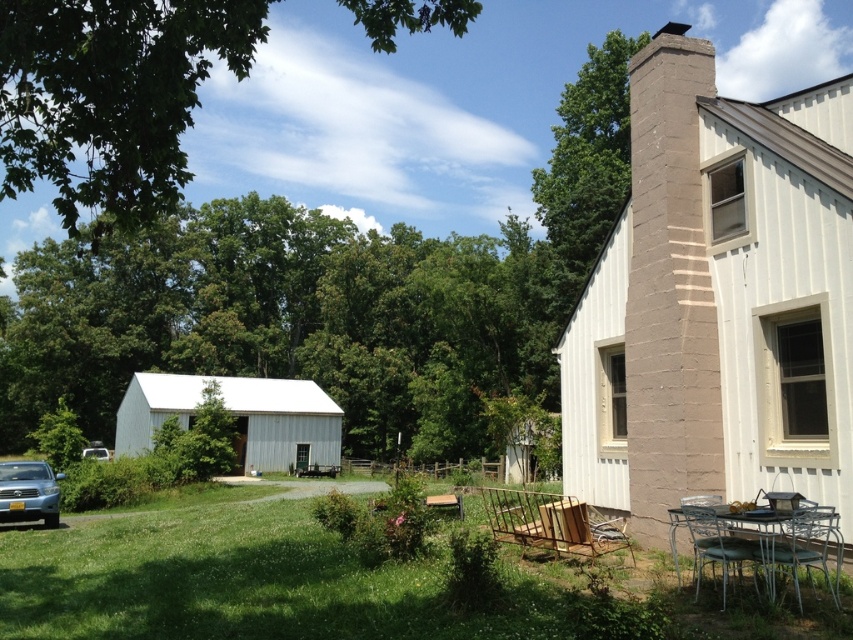
Who is taller, green leafy tree at upper left or metallic silver table at lower right?

With more height is green leafy tree at upper left.

Is green leafy tree at upper left closer to the viewer compared to metallic silver table at lower right?

Yes, it is.

Locate an element on the screen. green leafy tree at upper left is located at coordinates (111, 97).

Where is `green leafy tree at upper left`? The width and height of the screenshot is (853, 640). green leafy tree at upper left is located at coordinates (111, 97).

Which is above, wooden chair at lower center or white matte car at left?

wooden chair at lower center is higher up.

Does wooden chair at lower center have a larger size compared to white matte car at left?

No, wooden chair at lower center is not bigger than white matte car at left.

Which is in front, point (576, 513) or point (86, 449)?

Positioned in front is point (576, 513).

Locate an element on the screen. wooden chair at lower center is located at coordinates (579, 529).

Is white wood barn at center-right above white matte car at left?

Yes.

Which is behind, point (648, 534) or point (97, 449)?

Point (97, 449)

You are a GUI agent. You are given a task and a screenshot of the screen. Output one action in this format:
    pyautogui.click(x=<x>, y=<y>)
    Task: Click on the white wood barn at center-right
    This screenshot has width=853, height=640.
    Given the screenshot: What is the action you would take?
    pyautogui.click(x=717, y=301)